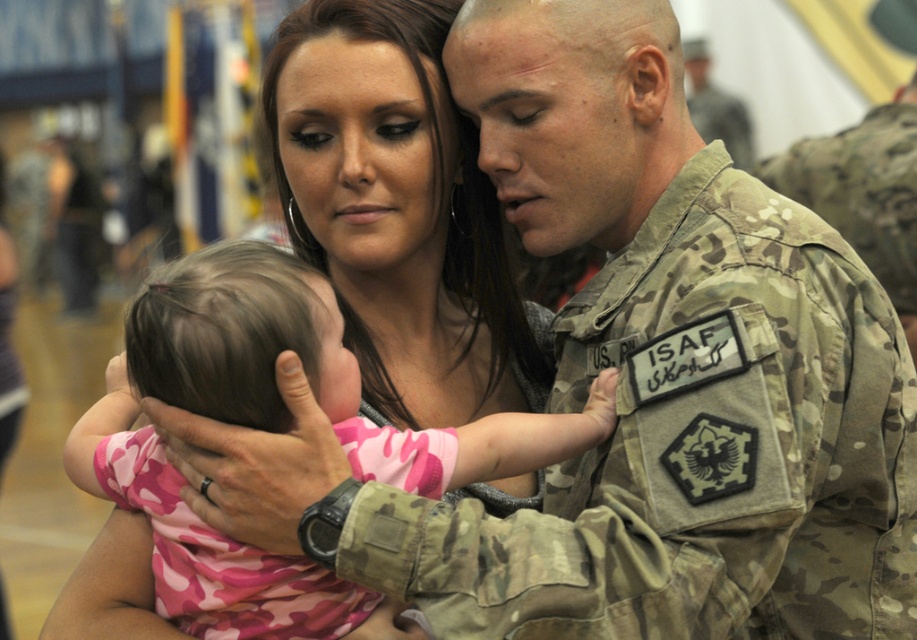
Consider the image. Is pink camouflage shirt at center positioned before camouflage uniform at center?

Yes, it is.

Can you confirm if pink camouflage shirt at center is positioned below camouflage uniform at center?

Indeed, pink camouflage shirt at center is positioned under camouflage uniform at center.

The height and width of the screenshot is (640, 917). I want to click on pink camouflage shirt at center, so [x=273, y=429].

Does point (667, 486) lie in front of point (737, 141)?

That is True.

Which is more to the right, camouflage fabric uniform at center or camouflage uniform at center?

camouflage uniform at center is more to the right.

Between point (866, 536) and point (732, 113), which one is positioned in front?

Point (866, 536)

Find the location of a particular element. This screenshot has width=917, height=640. camouflage fabric uniform at center is located at coordinates (694, 449).

Is camouflage fabric uniform at center smaller than pink camouflage shirt at center?

No, camouflage fabric uniform at center is not smaller than pink camouflage shirt at center.

Locate an element on the screen. camouflage fabric uniform at center is located at coordinates (694, 449).